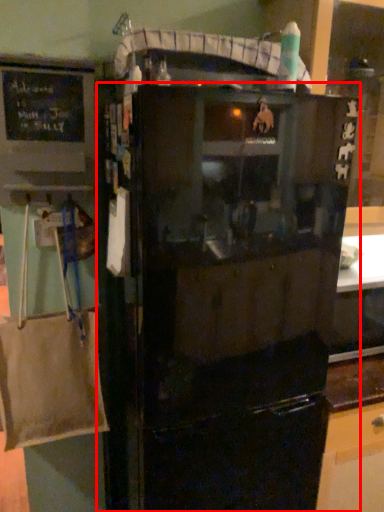
Question: From the image's perspective, what is the correct spatial relationship of refrigerator (annotated by the red box) in relation to bulletin board?

Choices:
 (A) above
 (B) below

Answer: (B)